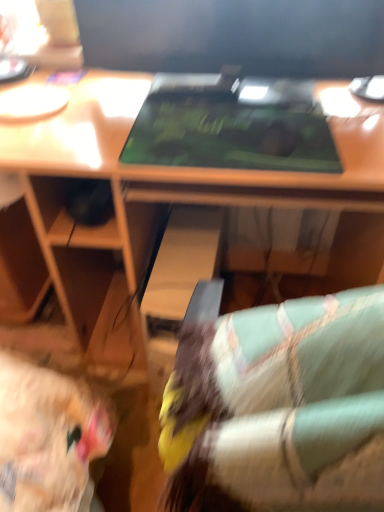
Find the location of a particular element. vacant point above green matte laptop at center (from a real-world perspective) is located at coordinates (231, 120).